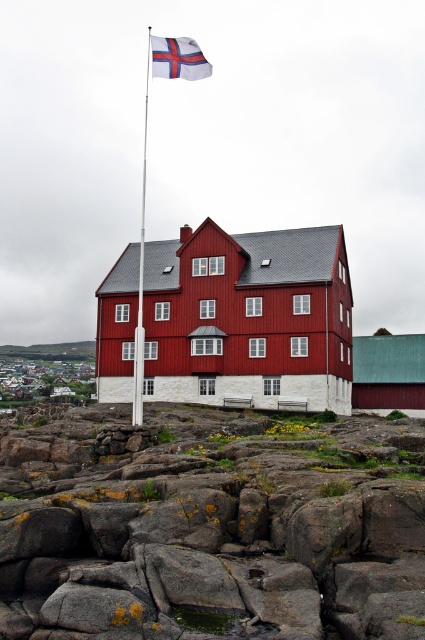
You are a photographer wanting to capture the rusty rock at center and the white fabric flag at upper center in the same frame. Based on their heights, which object will appear larger in the photo?

The white fabric flag at upper center will appear larger in the photo because it is taller than the rusty rock at center.